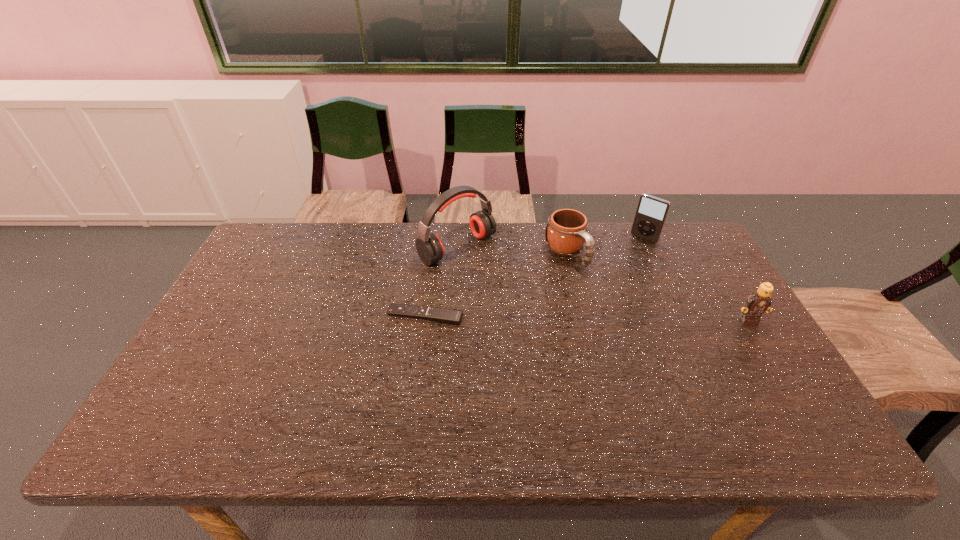
The image size is (960, 540). What are the coordinates of `Lego present at the right edge` in the screenshot? It's located at click(757, 303).

I want to click on iPod situated at the right edge, so click(x=651, y=213).

This screenshot has height=540, width=960. What are the coordinates of `object located in the far right corner section of the desktop` in the screenshot? It's located at (651, 213).

Image resolution: width=960 pixels, height=540 pixels. What are the coordinates of `vacant space at the far edge of the desktop` in the screenshot? It's located at (504, 250).

You are a GUI agent. You are given a task and a screenshot of the screen. Output one action in this format:
    pyautogui.click(x=<x>, y=<y>)
    Task: Click on the free space at the near edge of the desktop
    The width and height of the screenshot is (960, 540).
    Given the screenshot: What is the action you would take?
    pyautogui.click(x=311, y=409)

Locate an element on the screen. vacant area at the left edge is located at coordinates (200, 356).

This screenshot has width=960, height=540. I want to click on vacant space at the right edge, so click(x=718, y=282).

Locate an element on the screen. The height and width of the screenshot is (540, 960). free spot at the far left corner of the desktop is located at coordinates (271, 260).

You are a GUI agent. You are given a task and a screenshot of the screen. Output one action in this format:
    pyautogui.click(x=<x>, y=<y>)
    Task: Click on the free region at the near left corner
    The image size is (960, 540).
    Given the screenshot: What is the action you would take?
    pyautogui.click(x=213, y=389)

In the image, there is a desktop. Where is `blank space at the far right corner`? The width and height of the screenshot is (960, 540). blank space at the far right corner is located at coordinates (668, 238).